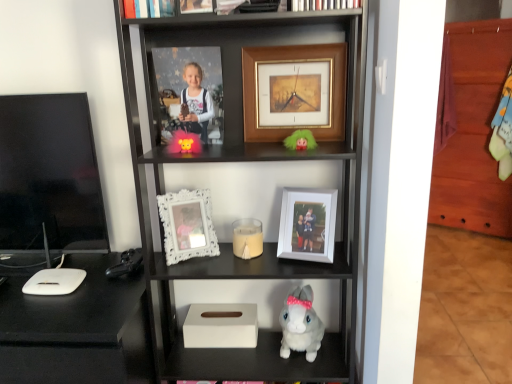
Question: Considering the positions of shiny orange plush toy at center, the first toy positioned from the top, and white matte tissue box at lower center in the image, is shiny orange plush toy at center, the first toy positioned from the top, wider or thinner than white matte tissue box at lower center?

Choices:
 (A) wide
 (B) thin

Answer: (B)

Question: In terms of size, does shiny orange plush toy at center, placed as the first toy when sorted from left to right, appear bigger or smaller than white matte tissue box at lower center?

Choices:
 (A) big
 (B) small

Answer: (B)

Question: Estimate the real-world distances between objects in this image. Which object is farther from the black glossy tv at left?

Choices:
 (A) black matte desk at left
 (B) white matte tissue box at lower center
 (C) white matte picture frame at center, the 5th picture frame positioned from the top
 (D) gold/gilded picture frame at upper center, which is the fourth picture frame in bottom-to-top order
 (E) white matte candle at center

Answer: (C)

Question: Which of these objects is positioned closest to the white plush rabbit at lower center, arranged as the second toy when viewed from the top?

Choices:
 (A) hardcover book at upper center, arranged as the first book when viewed from the left
 (B) white matte bookshelf at upper center, which appears as the 1th book when viewed from the right
 (C) black glossy tv at left
 (D) white matte tissue box at lower center
 (E) green fuzzy doll at upper center

Answer: (D)